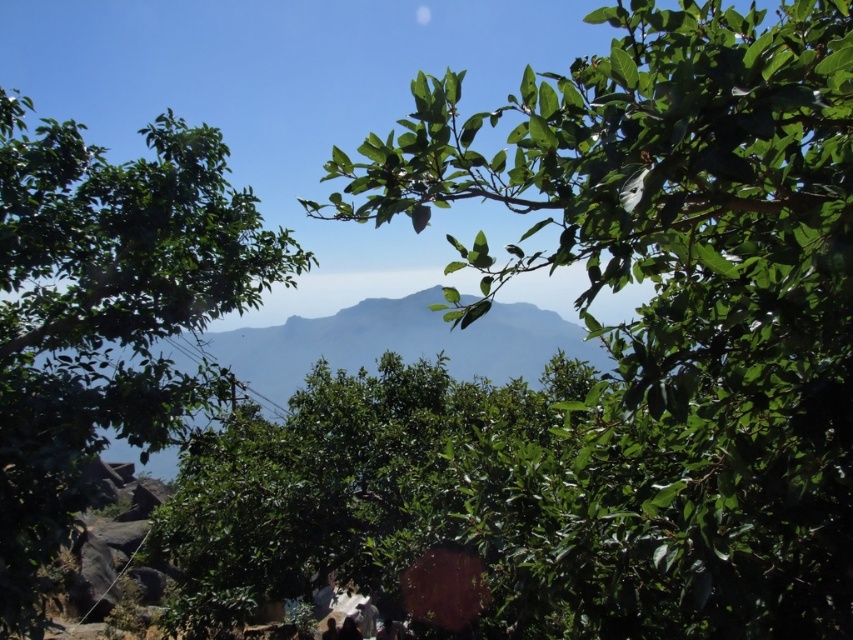
Can you confirm if green leafy branch at upper center is wider than green leafy tree at left?

In fact, green leafy branch at upper center might be narrower than green leafy tree at left.

Measure the distance between green leafy branch at upper center and camera.

A distance of 1.13 meters exists between green leafy branch at upper center and camera.

Describe the element at coordinates (680, 301) in the screenshot. I see `green leafy branch at upper center` at that location.

The image size is (853, 640). What are the coordinates of `green leafy branch at upper center` in the screenshot? It's located at (680, 301).